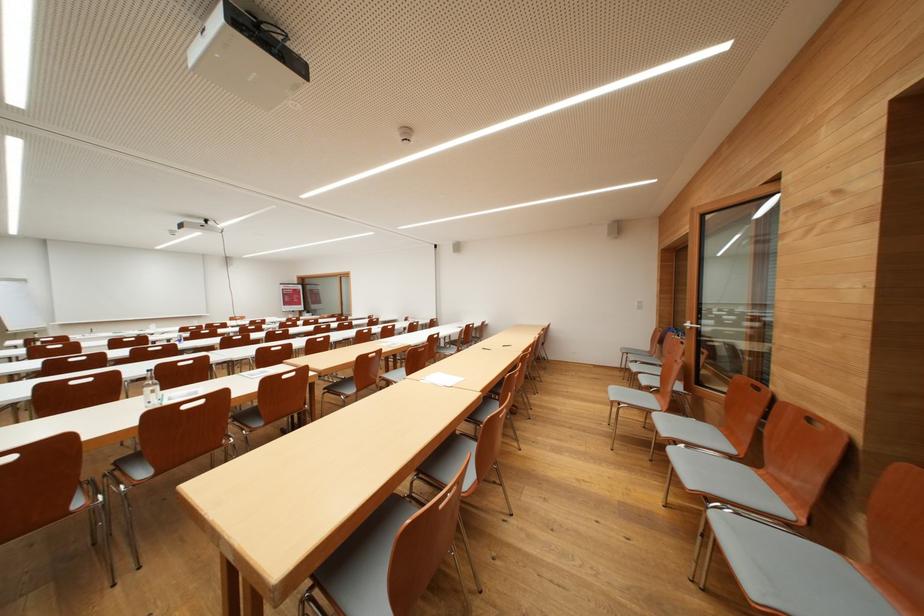
Identify the location of silver door handle. This screenshot has height=616, width=924. (689, 325).